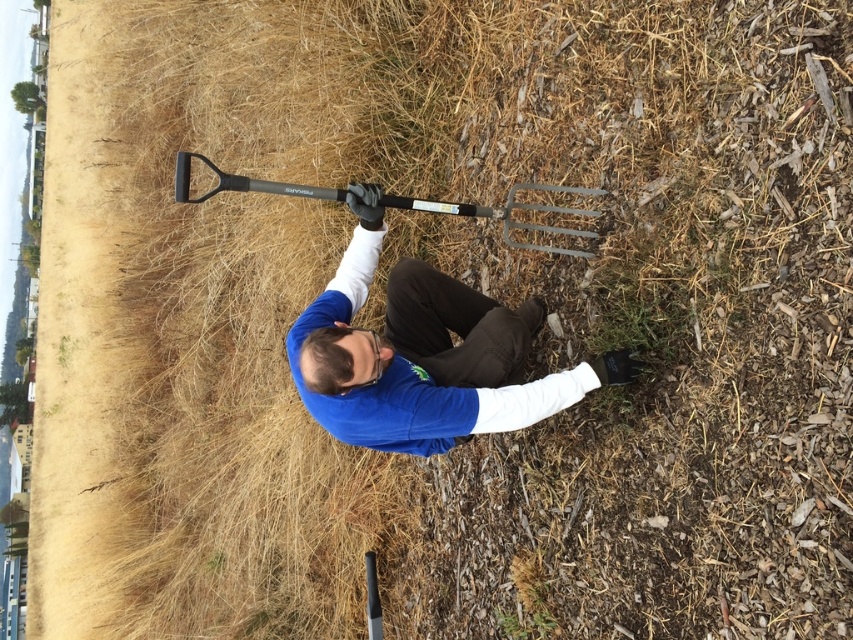
Can you confirm if matte black pitchfork at center is wider than black plastic shovel at upper center?

Yes.

Which of these two, matte black pitchfork at center or black plastic shovel at upper center, stands shorter?

black plastic shovel at upper center

Does point (363, 396) come closer to viewer compared to point (289, 186)?

Yes, point (363, 396) is closer to viewer.

Locate an element on the screen. This screenshot has width=853, height=640. matte black pitchfork at center is located at coordinates (424, 355).